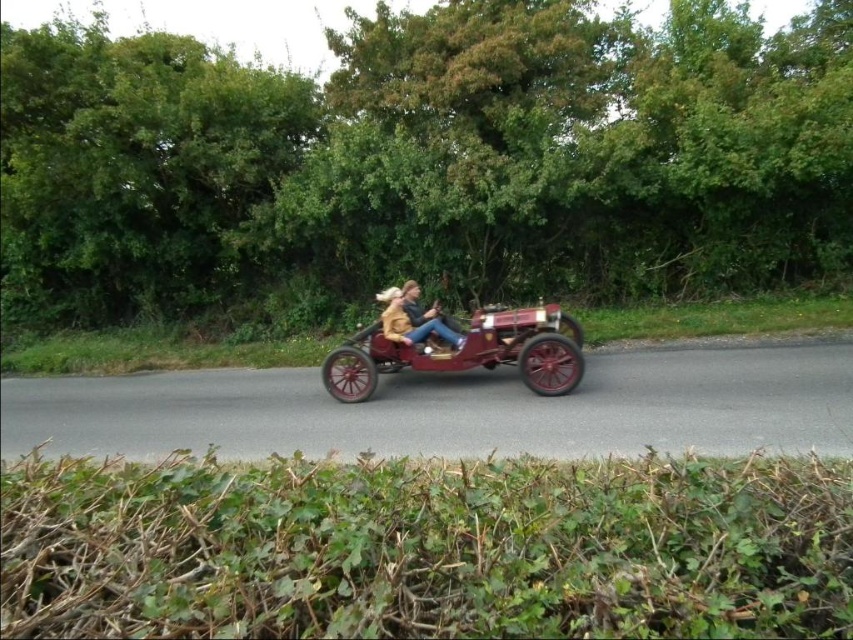
Can you confirm if maroon polished wood sidecar at center is bigger than leather jacket at center?

Yes.

I want to click on maroon polished wood sidecar at center, so click(x=466, y=353).

Is point (482, 358) behind point (422, 310)?

No, it is not.

What are the coordinates of `maroon polished wood sidecar at center` in the screenshot? It's located at (466, 353).